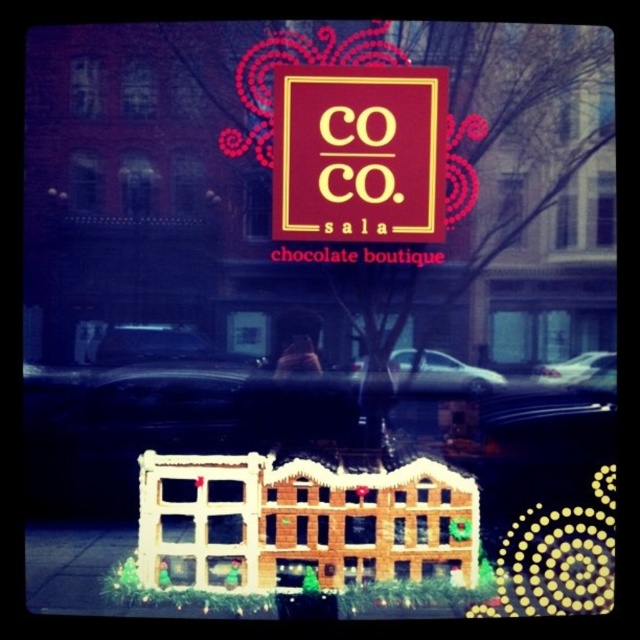
Between black glossy car at center and glossy black car at center, which one is positioned higher?

black glossy car at center is higher up.

Who is more distant from viewer, (x=147, y=326) or (x=598, y=358)?

Point (x=147, y=326)

The height and width of the screenshot is (640, 640). What are the coordinates of `black glossy car at center` in the screenshot? It's located at click(x=161, y=346).

Find the location of a particular element. This screenshot has width=640, height=640. black glossy car at center is located at coordinates (161, 346).

Does maroon matte sign at center come behind metallic silver car at center?

No, maroon matte sign at center is closer to the viewer.

Based on the photo, can you confirm if maroon matte sign at center is positioned above metallic silver car at center?

Correct, maroon matte sign at center is located above metallic silver car at center.

Does point (301, 132) come closer to viewer compared to point (499, 380)?

Yes, point (301, 132) is closer to viewer.

Locate an element on the screen. The height and width of the screenshot is (640, 640). maroon matte sign at center is located at coordinates (358, 154).

Can you confirm if maroon matte sign at center is positioned below matte gold "co" at center?

Indeed, maroon matte sign at center is positioned under matte gold "co" at center.

Based on the photo, who is lower down, maroon matte sign at center or matte gold "co" at center?

maroon matte sign at center

Which is behind, point (387, 227) or point (352, 112)?

The point (387, 227) is more distant.

Image resolution: width=640 pixels, height=640 pixels. What are the coordinates of `maroon matte sign at center` in the screenshot? It's located at (358, 154).